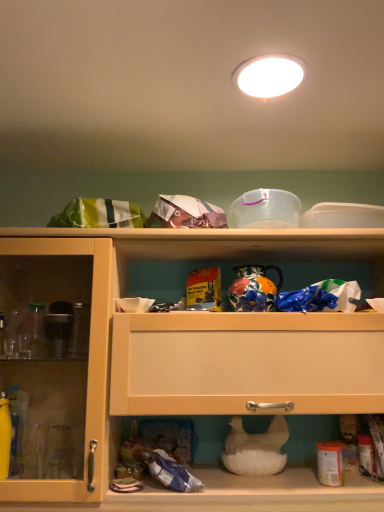
Question: Is white glossy light fixture at upper center turned away from matte wood cabinet at upper center?

Choices:
 (A) yes
 (B) no

Answer: (B)

Question: From the image's perspective, is white glossy light fixture at upper center located beneath matte wood cabinet at upper center?

Choices:
 (A) yes
 (B) no

Answer: (B)

Question: From a real-world perspective, is white glossy light fixture at upper center on top of matte wood cabinet at upper center?

Choices:
 (A) no
 (B) yes

Answer: (B)

Question: Could you tell me if white glossy light fixture at upper center is facing matte wood cabinet at upper center?

Choices:
 (A) yes
 (B) no

Answer: (B)

Question: From a real-world perspective, is white glossy light fixture at upper center below matte wood cabinet at upper center?

Choices:
 (A) no
 (B) yes

Answer: (A)

Question: Can you confirm if white glossy light fixture at upper center is wider than matte wood cabinet at upper center?

Choices:
 (A) no
 (B) yes

Answer: (A)

Question: Would you consider matte wood cabinet at upper center to be distant from white glossy light fixture at upper center?

Choices:
 (A) yes
 (B) no

Answer: (B)

Question: Considering the relative sizes of matte wood cabinet at upper center and white glossy light fixture at upper center in the image provided, is matte wood cabinet at upper center taller than white glossy light fixture at upper center?

Choices:
 (A) no
 (B) yes

Answer: (B)

Question: Can you confirm if matte wood cabinet at upper center is smaller than white glossy light fixture at upper center?

Choices:
 (A) yes
 (B) no

Answer: (B)

Question: Can white glossy light fixture at upper center be found inside matte wood cabinet at upper center?

Choices:
 (A) no
 (B) yes

Answer: (A)

Question: Does matte wood cabinet at upper center have a larger size compared to white glossy light fixture at upper center?

Choices:
 (A) no
 (B) yes

Answer: (B)

Question: Is matte wood cabinet at upper center closer to camera compared to white glossy light fixture at upper center?

Choices:
 (A) no
 (B) yes

Answer: (A)

Question: From a real-world perspective, relative to matte wood cabinet at upper center, is white glossy light fixture at upper center vertically above or below?

Choices:
 (A) below
 (B) above

Answer: (B)